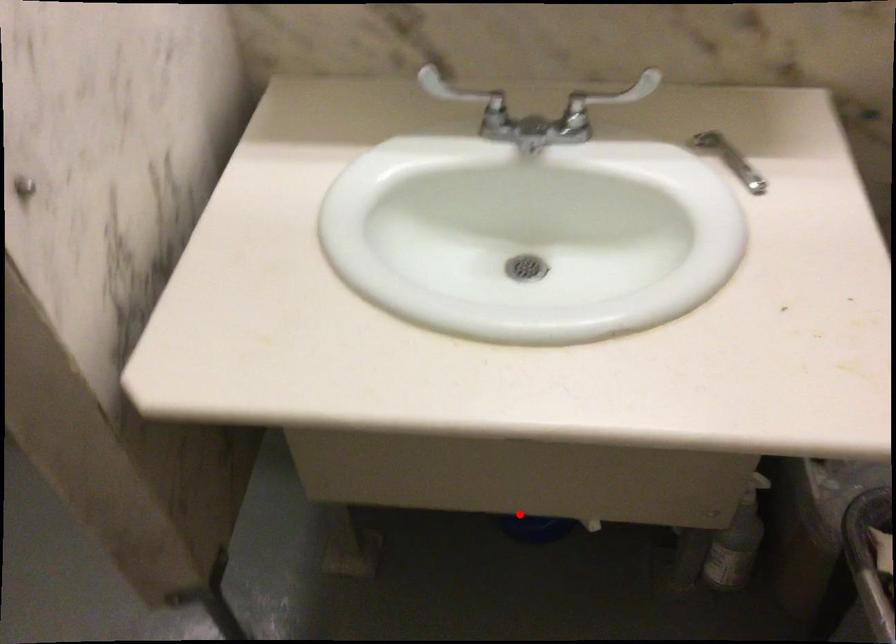
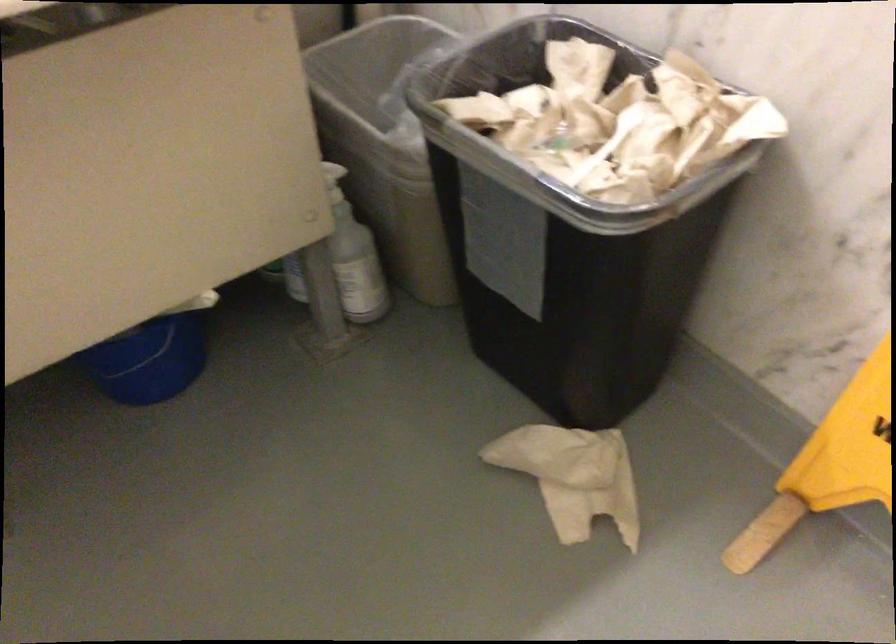
The point at the highlighted location is marked in the first image. Where is the corresponding point in the second image?

(149, 361)